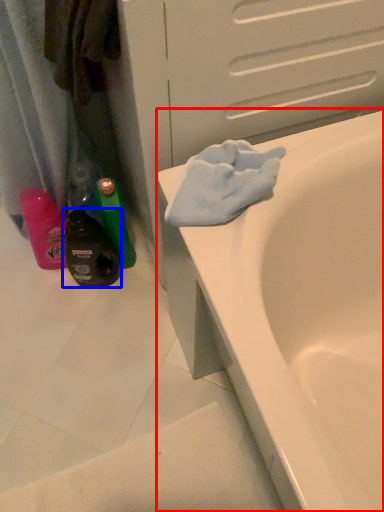
Question: Which point is further to the camera, bathtub (highlighted by a red box) or bottle (highlighted by a blue box)?

Choices:
 (A) bathtub
 (B) bottle

Answer: (B)